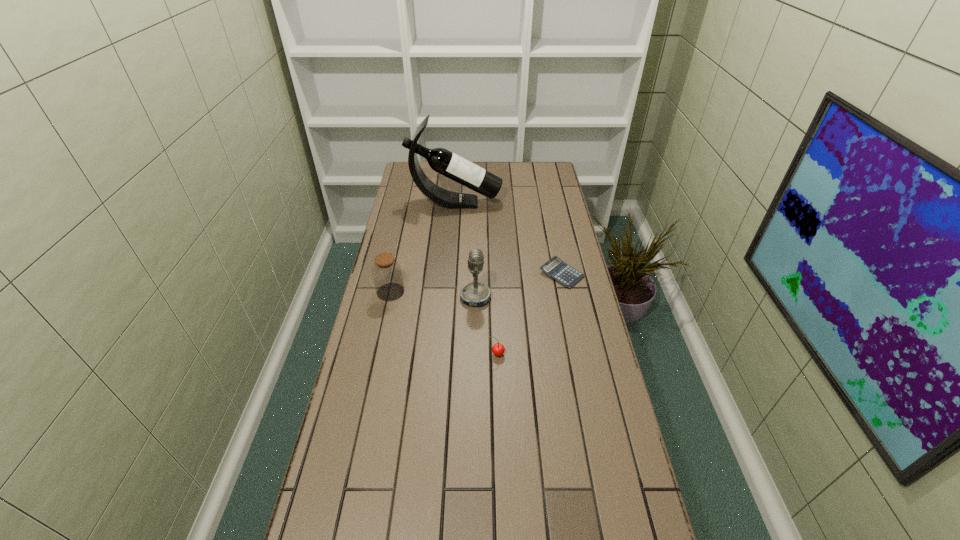
Image resolution: width=960 pixels, height=540 pixels. Identify the location of vacant space that satisfies the following two spatial constraints: 1. on the stand of the cherry; 2. on the left side of the farthest object. (444, 354).

You are a GUI agent. You are given a task and a screenshot of the screen. Output one action in this format:
    pyautogui.click(x=<x>, y=<y>)
    Task: Click on the vacant space that satisfies the following two spatial constraints: 1. on the front-facing side of the nearest object; 2. on the right side of the second tallest object
    The height and width of the screenshot is (540, 960).
    Given the screenshot: What is the action you would take?
    pyautogui.click(x=475, y=354)